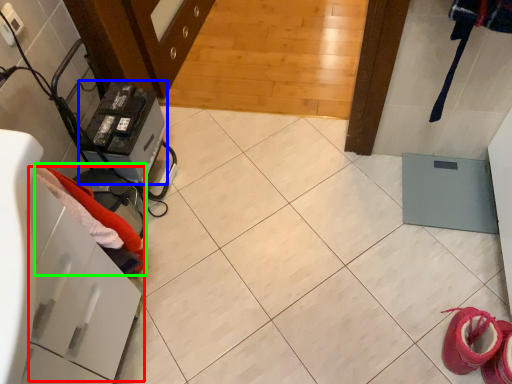
Question: Considering the real-world distances, which object is closest to drawer (highlighted by a red box)? appliance (highlighted by a blue box) or clothing (highlighted by a green box).

Choices:
 (A) appliance
 (B) clothing

Answer: (B)